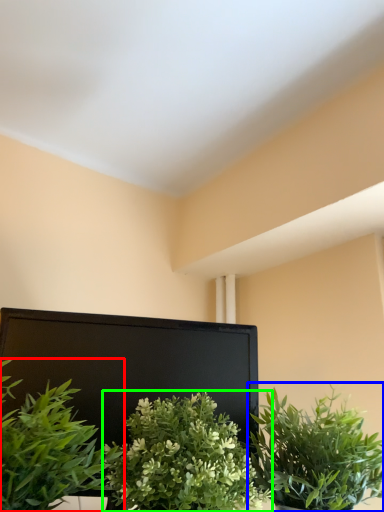
Question: Considering the real-world distances, which object is farthest from houseplant (highlighted by a red box)? houseplant (highlighted by a blue box) or houseplant (highlighted by a green box)?

Choices:
 (A) houseplant
 (B) houseplant

Answer: (A)